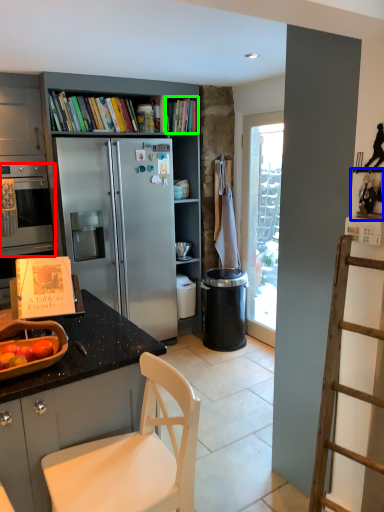
Question: Which is nearer to the oven (highlighted by a red box)? shelf (highlighted by a blue box) or book (highlighted by a green box).

Choices:
 (A) shelf
 (B) book

Answer: (B)